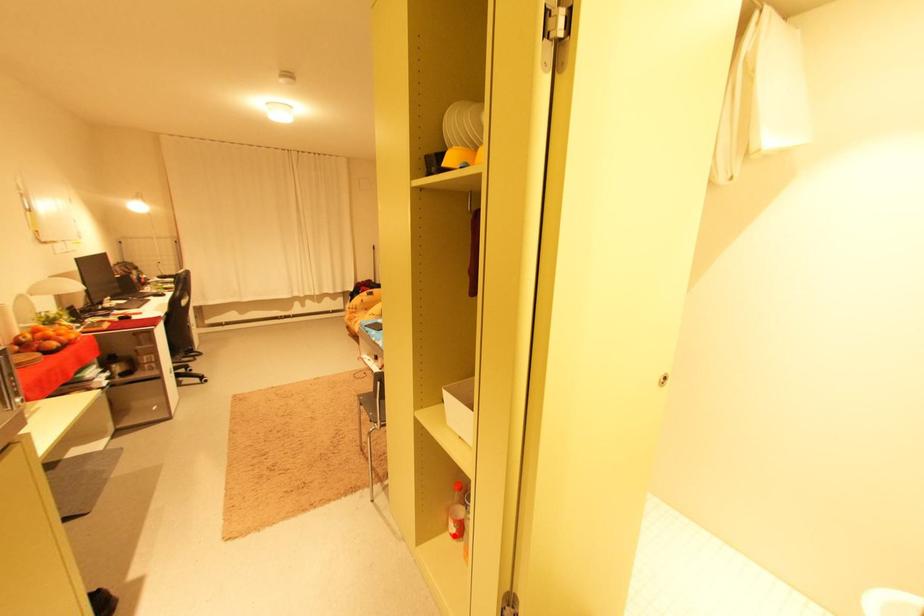
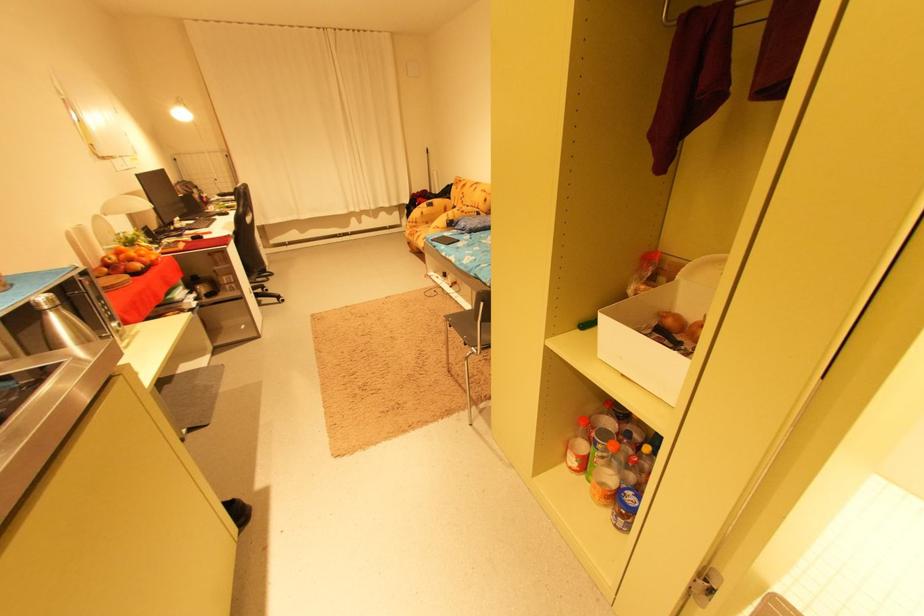
Question: I am providing you with two images of the same scene from different viewpoints. A red point is shown in image1. For the corresponding object point in image2, is it positioned nearer or farther from the camera?

Choices:
 (A) Nearer
 (B) Farther

Answer: (A)